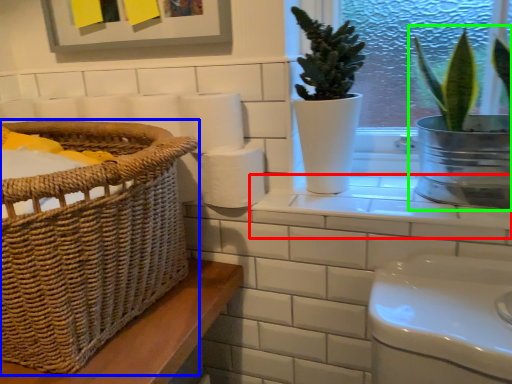
Question: Which is farther away from window sill (highlighted by a red box)? basket (highlighted by a blue box) or houseplant (highlighted by a green box)?

Choices:
 (A) basket
 (B) houseplant

Answer: (A)